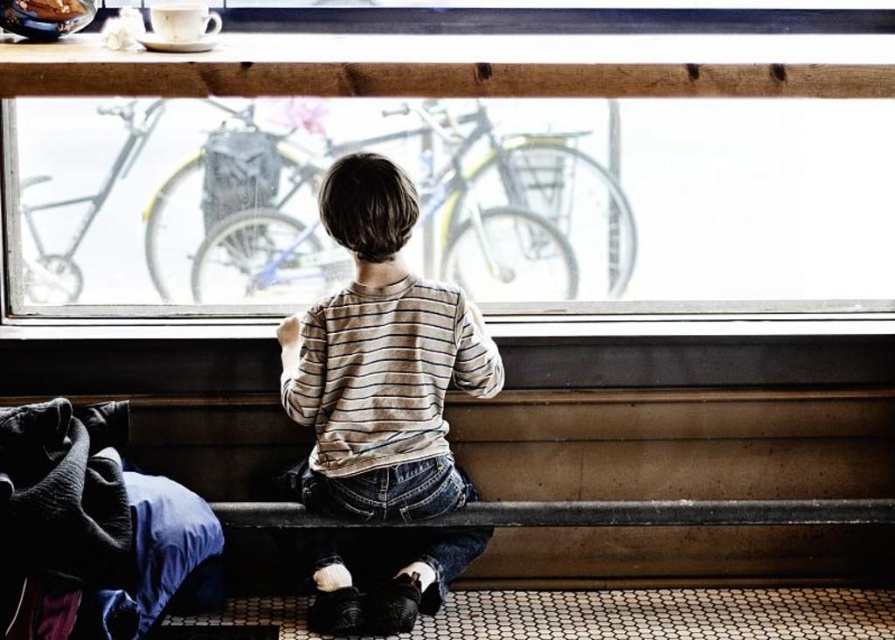
You are a delivery person who needs to hand a package to the child at the bench. The package is too large to fit through the clear glass window at center. What should you do?

The clear glass window at center is 8.47 feet from the camera, so you should approach the child directly through the entrance instead of trying to pass the package through the window since it is too large and the window is only 8.47 feet away but not an accessible pathway.

What is the exact coordinate of the clear glass window at center in the image?

The clear glass window at center is located at point [459,173].